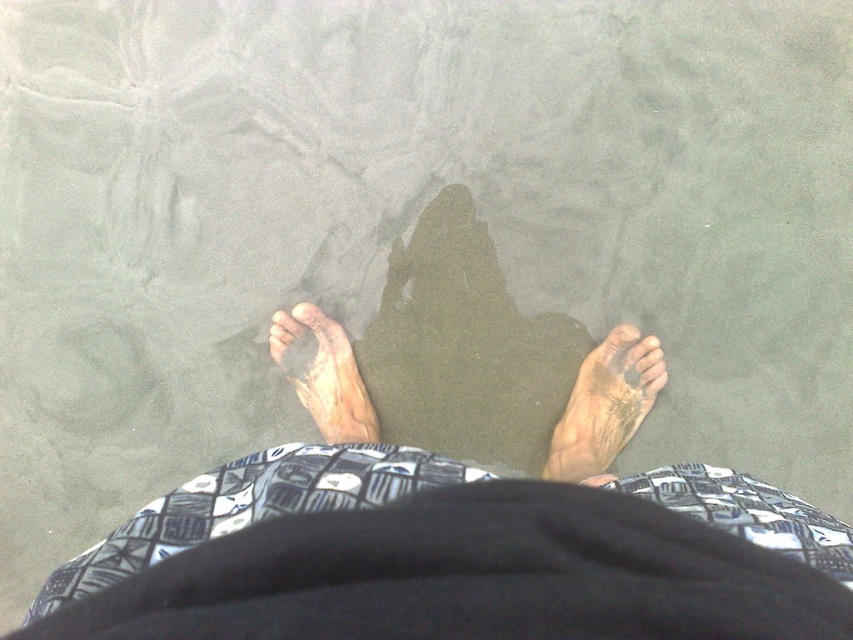
Question: Which point is farther to the camera?

Choices:
 (A) pale skin toe at center
 (B) brown sand at center
 (C) dry skin foot at center
 (D) brown skin at center

Answer: (A)

Question: Is brown skin at center above brown matte toe at lower right?

Choices:
 (A) yes
 (B) no

Answer: (B)

Question: Is brown sand at center positioned in front of pale skin toe at center?

Choices:
 (A) no
 (B) yes

Answer: (B)

Question: Which of the following is the closest to the observer?

Choices:
 (A) (447, 227)
 (B) (769, 632)
 (C) (296, 308)

Answer: (B)

Question: Among these objects, which one is nearest to the camera?

Choices:
 (A) dry skin foot at center
 (B) pale skin toe at center
 (C) brown skin at center
 (D) brown sand at center

Answer: (C)

Question: Is brown sand at center to the right of brown matte toe at lower right from the viewer's perspective?

Choices:
 (A) no
 (B) yes

Answer: (A)